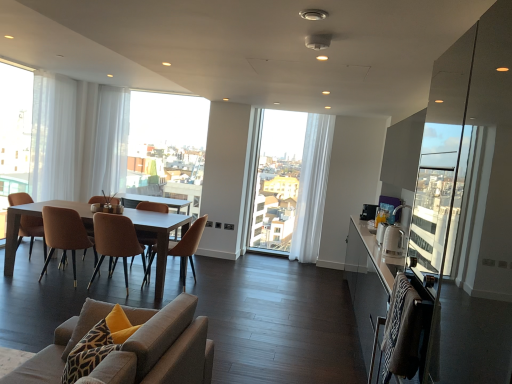
Image resolution: width=512 pixels, height=384 pixels. I want to click on free point in front of brown fabric chair at center, the 3th chair viewed from the front, so click(30, 289).